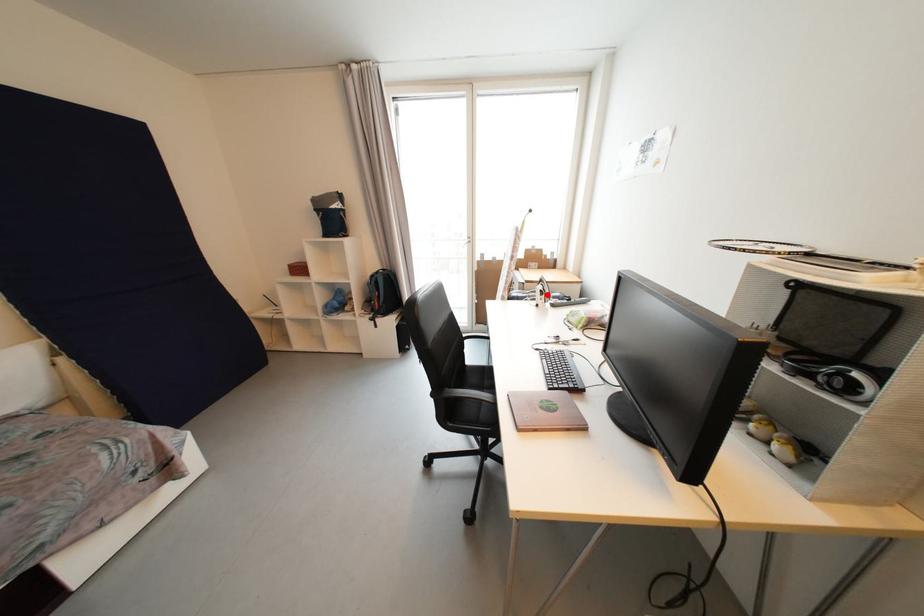
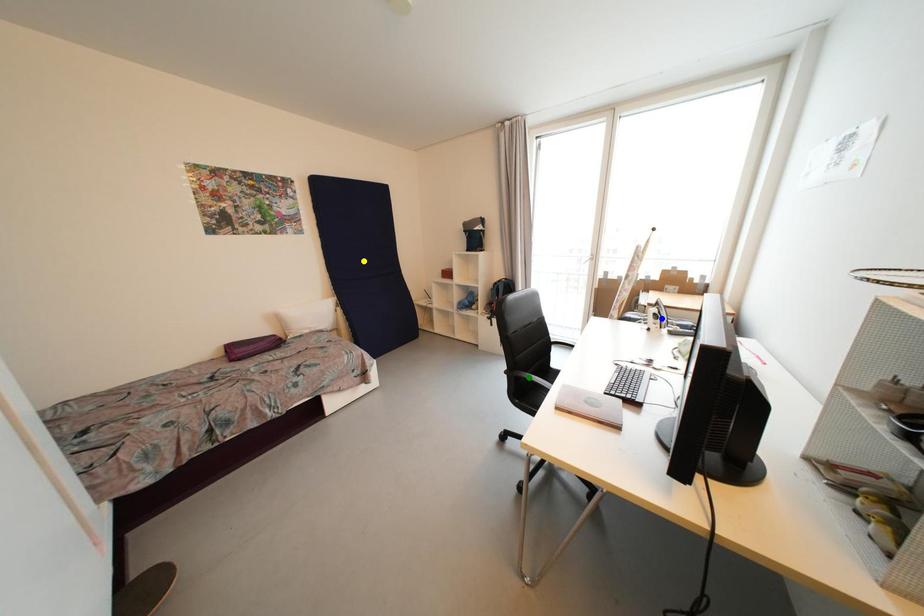
Question: I am providing you with two images of the same scene from different viewpoints. A red point is marked on the first image. You are given multiple points on the second image. Which point in image 2 represents the same 3d spot as the red point in image 1?

Choices:
 (A) blue point
 (B) green point
 (C) yellow point

Answer: (A)